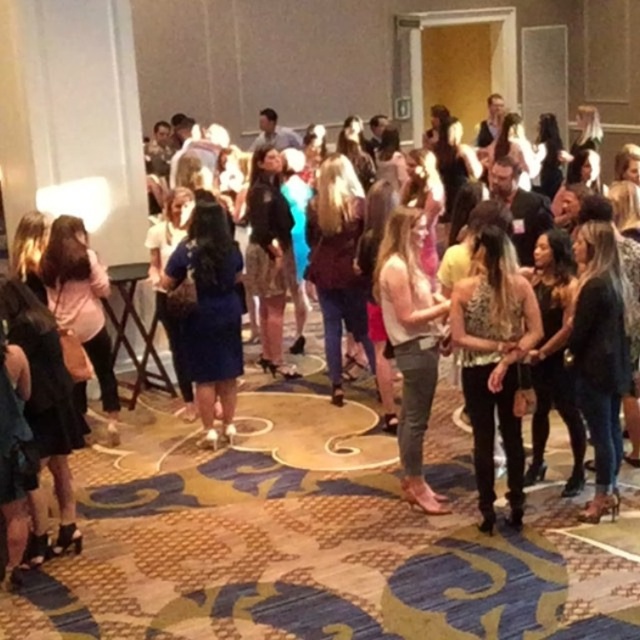
You are a photographer at the event and need to capture a photo of both the leopard print top at center and the denim jeans at center. Since you want to highlight both items equally, which one should you adjust the camera angle to focus on more to ensure they appear balanced in the photo?

The leopard print top at center has a lesser height compared to the denim jeans at center. To balance them in the photo, you should focus more on the leopard print top at center to compensate for its smaller size.

You are organizing a photo shoot and want to ensure the leopard print top at center and the blue satin dress at center are both visible in the frame. Given their positions, which one is positioned lower and might require adjusting the camera angle to capture both effectively?

The leopard print top at center is below the blue satin dress at center, so adjusting the camera angle downward slightly would help capture both in the frame.